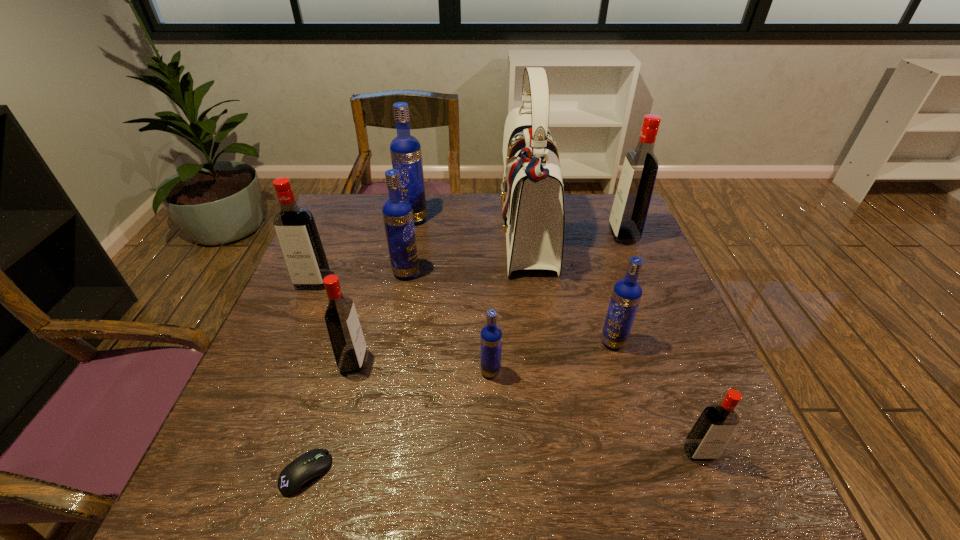
You are a GUI agent. You are given a task and a screenshot of the screen. Output one action in this format:
    pyautogui.click(x=<x>, y=<y>)
    Task: Click on the satchel that is positioned at the far edge
    Image resolution: width=960 pixels, height=540 pixels.
    Given the screenshot: What is the action you would take?
    pyautogui.click(x=532, y=196)

Locate an element on the screen. vodka that is at the near edge is located at coordinates (710, 434).

At what (x,y) coordinates should I click in order to perform the action: click on computer equipment present at the near edge. Please return your answer as a coordinate pair (x, y). Looking at the image, I should click on (295, 477).

Find the location of a particular element. This screenshot has height=540, width=960. vodka located in the left edge section of the desktop is located at coordinates (295, 227).

Where is `computer equipment located at the left edge`? computer equipment located at the left edge is located at coordinates [295, 477].

The image size is (960, 540). Find the location of `object positioned at the near left corner`. object positioned at the near left corner is located at coordinates (295, 477).

Identify the location of object located in the far right corner section of the desktop. (633, 195).

Where is `object situated at the near right corner`? The image size is (960, 540). object situated at the near right corner is located at coordinates (710, 434).

Where is `vacant area at the far edge of the desktop`? This screenshot has height=540, width=960. vacant area at the far edge of the desktop is located at coordinates (482, 226).

The image size is (960, 540). Find the location of `free spot at the near edge of the desktop`. free spot at the near edge of the desktop is located at coordinates (403, 469).